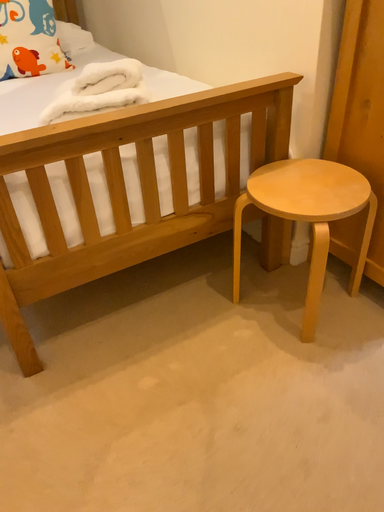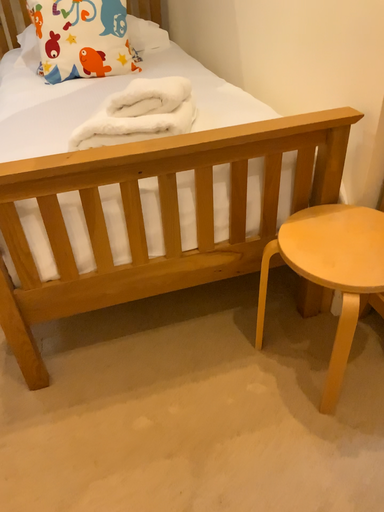
Question: Which way did the camera rotate in the video?

Choices:
 (A) rotated left
 (B) rotated right

Answer: (A)